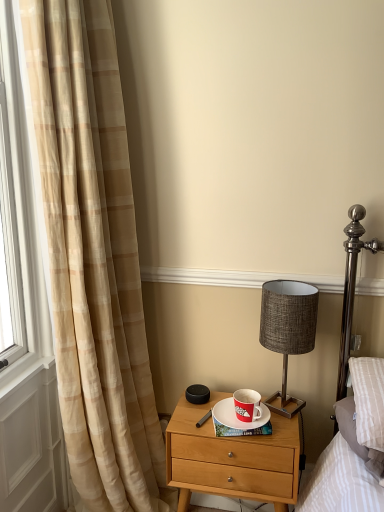
Where is `free point below metallic gray lampshade at center-right (from a real-world perspective)`? free point below metallic gray lampshade at center-right (from a real-world perspective) is located at coordinates (278, 402).